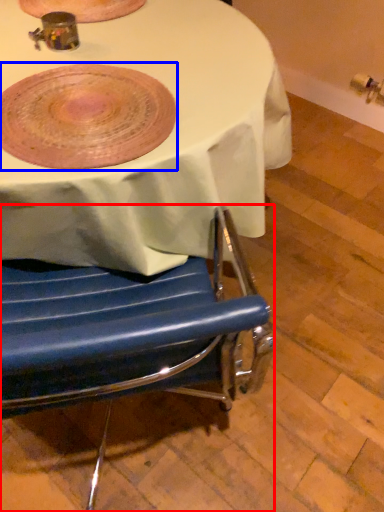
Question: Which object is closer to the camera taking this photo, chair (highlighted by a red box) or platter (highlighted by a blue box)?

Choices:
 (A) chair
 (B) platter

Answer: (B)